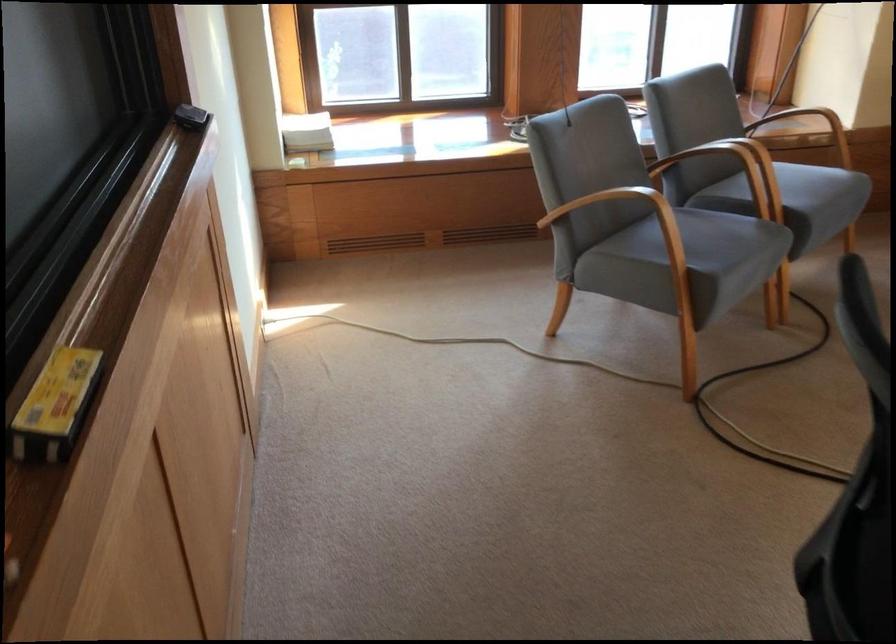
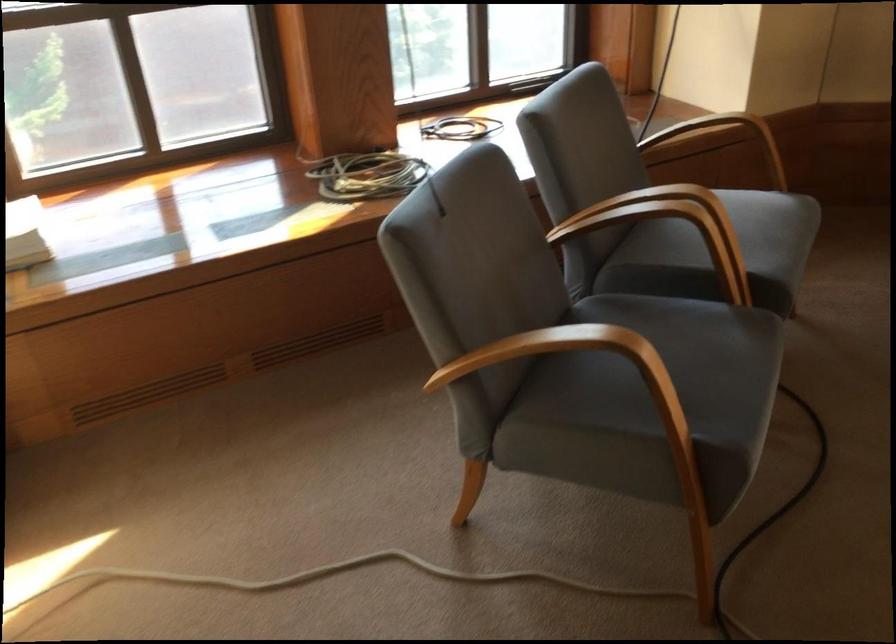
Locate, in the second image, the point that corresponds to (797,174) in the first image.

(752, 232)